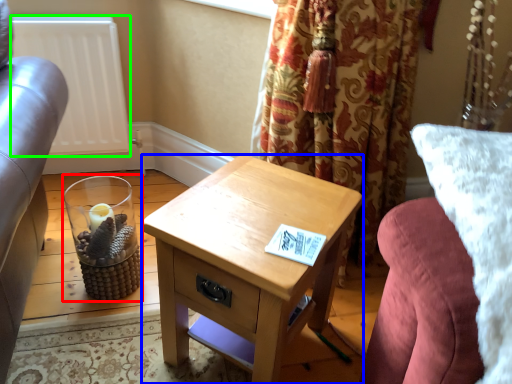
Question: Which object is the closest to the candle holder (highlighted by a red box)? Choose among these: nightstand (highlighted by a blue box) or radiator (highlighted by a green box).

Choices:
 (A) nightstand
 (B) radiator

Answer: (B)